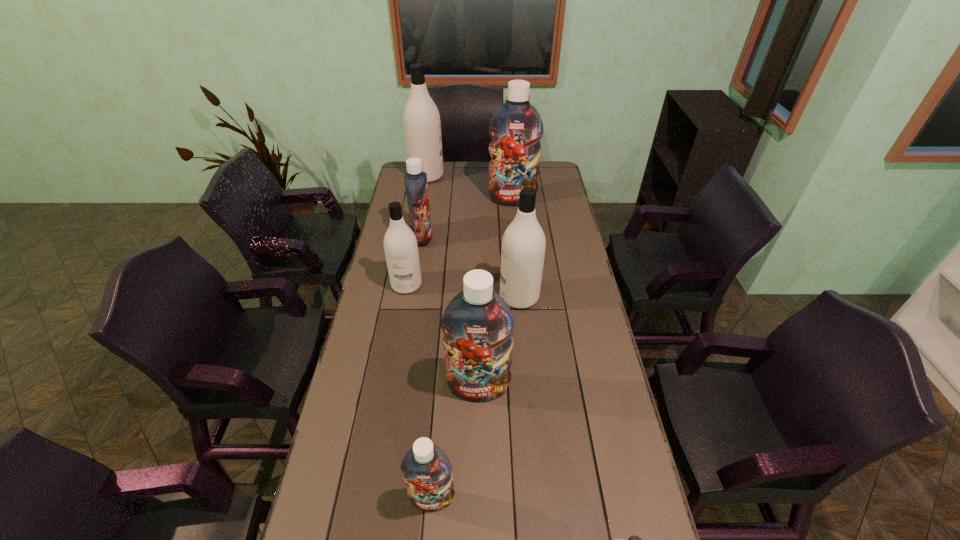
Find the location of a particular element. Image resolution: width=960 pixels, height=540 pixels. the biggest white shampoo is located at coordinates (421, 119).

Identify the location of the farthest shampoo. The width and height of the screenshot is (960, 540). (421, 119).

Where is `the seventh nearest object`? the seventh nearest object is located at coordinates (516, 128).

At what (x,y) coordinates should I click in order to perform the action: click on the seventh nearest shampoo. Please return your answer as a coordinate pair (x, y). The width and height of the screenshot is (960, 540). Looking at the image, I should click on (516, 128).

Where is `the third smallest white shampoo`? the third smallest white shampoo is located at coordinates (523, 245).

You are a GUI agent. You are given a task and a screenshot of the screen. Output one action in this format:
    pyautogui.click(x=<x>, y=<y>)
    Task: Click on the sixth farthest shampoo
    
    Given the screenshot: What is the action you would take?
    pyautogui.click(x=478, y=324)

Locate an element on the screen. the sixth farthest object is located at coordinates (478, 324).

I want to click on the sixth nearest object, so click(x=416, y=186).

Identify the location of the sixth nearest shampoo. The height and width of the screenshot is (540, 960). (416, 186).

Where is `the third biggest white shampoo`? Image resolution: width=960 pixels, height=540 pixels. the third biggest white shampoo is located at coordinates (400, 244).